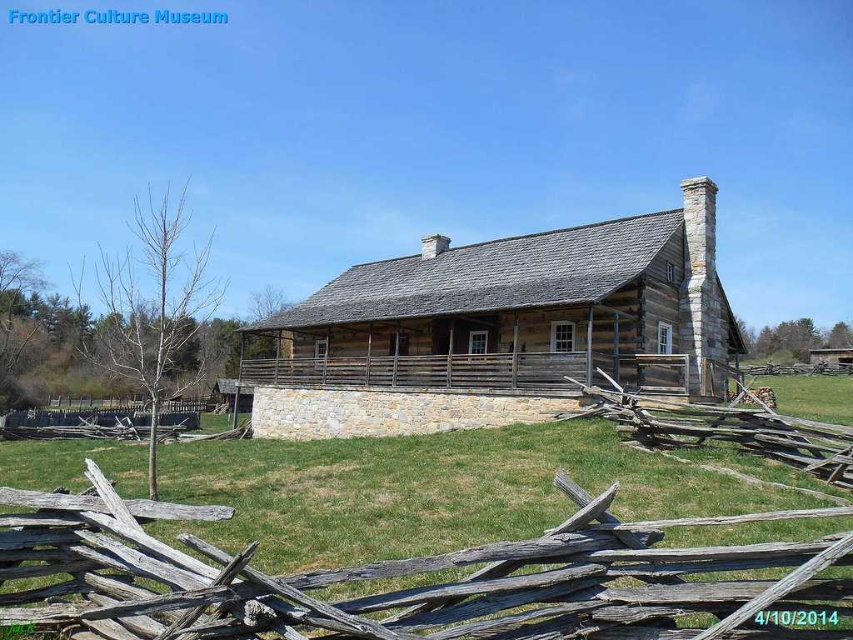
Question: Is weathered wood fence at lower center below rustic wood cabin at center?

Choices:
 (A) no
 (B) yes

Answer: (B)

Question: Among these points, which one is nearest to the camera?

Choices:
 (A) (811, 625)
 (B) (341, 294)

Answer: (A)

Question: Which object is closer to the camera taking this photo?

Choices:
 (A) rustic wood cabin at center
 (B) weathered wood fence at lower center

Answer: (B)

Question: Is weathered wood fence at lower center below rustic wood cabin at center?

Choices:
 (A) yes
 (B) no

Answer: (A)

Question: Is weathered wood fence at lower center below rustic wood cabin at center?

Choices:
 (A) no
 (B) yes

Answer: (B)